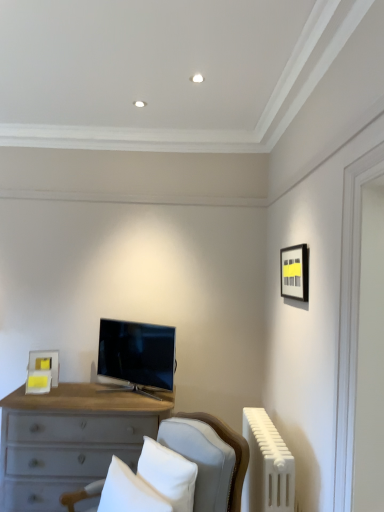
Question: In which direction should I rotate to look at white fabric pillow at center, the first pillow positioned from the right?

Choices:
 (A) right
 (B) left

Answer: (B)

Question: Which direction should I rotate to look at white soft pillow at lower center, positioned as the 2th pillow in right-to-left order?

Choices:
 (A) left
 (B) right

Answer: (A)

Question: From a real-world perspective, is white fabric pillow at center, the first pillow positioned from the right, positioned over satin black tv at center based on gravity?

Choices:
 (A) no
 (B) yes

Answer: (A)

Question: Can you confirm if white fabric pillow at center, the first pillow positioned from the right, is wider than satin black tv at center?

Choices:
 (A) yes
 (B) no

Answer: (B)

Question: Can you confirm if white fabric pillow at center, the second pillow in the left-to-right sequence, is positioned to the left of satin black tv at center?

Choices:
 (A) yes
 (B) no

Answer: (B)

Question: Is white fabric pillow at center, the second pillow in the left-to-right sequence, smaller than satin black tv at center?

Choices:
 (A) no
 (B) yes

Answer: (B)

Question: From the image's perspective, is white fabric pillow at center, the first pillow positioned from the right, above satin black tv at center?

Choices:
 (A) no
 (B) yes

Answer: (A)

Question: Could you tell me if white fabric pillow at center, the second pillow in the left-to-right sequence, is facing satin black tv at center?

Choices:
 (A) yes
 (B) no

Answer: (B)

Question: Is there a large distance between white soft pillow at lower center, positioned as the 2th pillow in right-to-left order, and satin black tv at center?

Choices:
 (A) no
 (B) yes

Answer: (A)

Question: From a real-world perspective, is white soft pillow at lower center, positioned as the 2th pillow in right-to-left order, on top of satin black tv at center?

Choices:
 (A) yes
 (B) no

Answer: (B)

Question: Can you confirm if white soft pillow at lower center, positioned as the 2th pillow in right-to-left order, is wider than satin black tv at center?

Choices:
 (A) yes
 (B) no

Answer: (B)

Question: Can you confirm if white soft pillow at lower center, positioned as the 2th pillow in right-to-left order, is smaller than satin black tv at center?

Choices:
 (A) no
 (B) yes

Answer: (B)

Question: From the image's perspective, is white soft pillow at lower center, positioned as the 2th pillow in right-to-left order, over satin black tv at center?

Choices:
 (A) yes
 (B) no

Answer: (B)

Question: Is satin black tv at center at the back of white soft pillow at lower center, positioned as the 2th pillow in right-to-left order?

Choices:
 (A) no
 (B) yes

Answer: (A)

Question: Does matte black picture frame at upper right, which appears as the first picture frame when viewed from the right, come behind satin black tv at center?

Choices:
 (A) yes
 (B) no

Answer: (B)